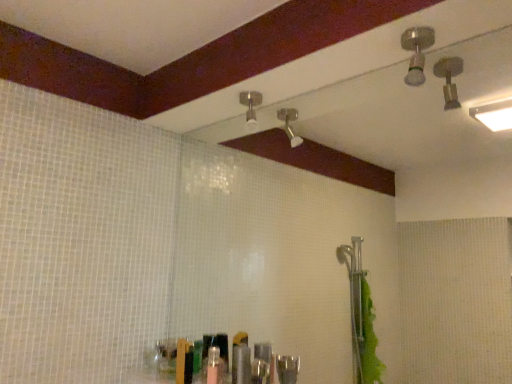
This screenshot has height=384, width=512. Describe the element at coordinates (250, 106) in the screenshot. I see `matte silver shower head at upper center, the 2th shower positioned from the right` at that location.

The image size is (512, 384). What do you see at coordinates (241, 359) in the screenshot?
I see `metallic silver toiletries at center` at bounding box center [241, 359].

Identify the location of matte silver shower head at upper center, the 2th shower in the front-to-back sequence. (250, 106).

I want to click on shower below the brushed metal shower head at upper right, acting as the 2th shower starting from the left (from the image's perspective), so click(x=250, y=106).

Looking at this image, considering the relative positions of brushed metal shower head at upper right, positioned as the 1th shower in front-to-back order, and matte silver shower head at upper center, the 1th shower from the left, in the image provided, is brushed metal shower head at upper right, positioned as the 1th shower in front-to-back order, to the left of matte silver shower head at upper center, the 1th shower from the left, from the viewer's perspective?

No.

From a real-world perspective, is brushed metal shower head at upper right, acting as the first shower starting from the right, positioned under matte silver shower head at upper center, the 2th shower positioned from the right, based on gravity?

Actually, brushed metal shower head at upper right, acting as the first shower starting from the right, is physically above matte silver shower head at upper center, the 2th shower positioned from the right, in the real world.

From the image's perspective, which object appears higher, brushed metal shower head at upper right, acting as the 2th shower starting from the left, or matte silver shower head at upper center, the 2th shower positioned from the right?

brushed metal shower head at upper right, acting as the 2th shower starting from the left.

Is metallic silver toiletries at center oriented away from brushed metal shower head at upper right, acting as the first shower starting from the right?

No.

From the image's perspective, would you say metallic silver toiletries at center is shown under brushed metal shower head at upper right, marked as the 2th shower in a back-to-front arrangement?

Correct, metallic silver toiletries at center appears lower than brushed metal shower head at upper right, marked as the 2th shower in a back-to-front arrangement, in the image.

Between metallic silver toiletries at center and brushed metal shower head at upper right, marked as the 2th shower in a back-to-front arrangement, which one has more height?

metallic silver toiletries at center.

Is metallic silver toiletries at center in contact with brushed metal shower head at upper right, marked as the 2th shower in a back-to-front arrangement?

No, metallic silver toiletries at center is not in contact with brushed metal shower head at upper right, marked as the 2th shower in a back-to-front arrangement.

Does brushed metal shower head at upper right, acting as the first shower starting from the right, turn towards metallic silver toiletries at center?

No, brushed metal shower head at upper right, acting as the first shower starting from the right, is not aimed at metallic silver toiletries at center.

Is brushed metal shower head at upper right, acting as the first shower starting from the right, taller than metallic silver toiletries at center?

In fact, brushed metal shower head at upper right, acting as the first shower starting from the right, may be shorter than metallic silver toiletries at center.

Measure the distance from brushed metal shower head at upper right, acting as the 2th shower starting from the left, to metallic silver toiletries at center.

brushed metal shower head at upper right, acting as the 2th shower starting from the left, and metallic silver toiletries at center are 1.08 meters apart.

In the scene shown: Does matte silver shower head at upper center, which appears as the 1th shower when viewed from the back, come behind brushed metal shower head at upper right, marked as the 2th shower in a back-to-front arrangement?

Yes, it is behind brushed metal shower head at upper right, marked as the 2th shower in a back-to-front arrangement.

Does point (249, 108) come behind point (415, 43)?

Yes, it is behind point (415, 43).

From a real-world perspective, is matte silver shower head at upper center, the 2th shower positioned from the right, over brushed metal shower head at upper right, marked as the 2th shower in a back-to-front arrangement?

No.

Who is bigger, matte silver shower head at upper center, the 1th shower from the left, or brushed metal shower head at upper right, positioned as the 1th shower in front-to-back order?

matte silver shower head at upper center, the 1th shower from the left.

How different are the orientations of metallic silver toiletries at center and matte silver shower head at upper center, the 2th shower in the front-to-back sequence, in degrees?

The facing directions of metallic silver toiletries at center and matte silver shower head at upper center, the 2th shower in the front-to-back sequence, are 1.15 degrees apart.

Is metallic silver toiletries at center thinner than matte silver shower head at upper center, the 1th shower from the left?

Yes.

From their relative heights in the image, would you say metallic silver toiletries at center is taller or shorter than matte silver shower head at upper center, the 2th shower in the front-to-back sequence?

metallic silver toiletries at center is taller than matte silver shower head at upper center, the 2th shower in the front-to-back sequence.

Which point is more forward, (248, 360) or (261, 99)?

The point (248, 360) is closer.

You are a GUI agent. You are given a task and a screenshot of the screen. Output one action in this format:
    pyautogui.click(x=<x>, y=<y>)
    Task: Click on the 1st shower located above the metallic silver toiletries at center (from a real-world perspective)
    
    Given the screenshot: What is the action you would take?
    pyautogui.click(x=250, y=106)

Based on their sizes in the image, would you say matte silver shower head at upper center, which appears as the 1th shower when viewed from the back, is bigger or smaller than metallic silver toiletries at center?

matte silver shower head at upper center, which appears as the 1th shower when viewed from the back, is bigger than metallic silver toiletries at center.

Is matte silver shower head at upper center, the 1th shower from the left, oriented towards metallic silver toiletries at center?

No, matte silver shower head at upper center, the 1th shower from the left, is not turned towards metallic silver toiletries at center.

Is point (254, 103) positioned in front of point (245, 373)?

No, it is not.

What are the coordinates of `shower located in front of the matte silver shower head at upper center, the 2th shower in the front-to-back sequence` in the screenshot? It's located at (417, 52).

Image resolution: width=512 pixels, height=384 pixels. I want to click on toiletry located on the left of brushed metal shower head at upper right, marked as the 2th shower in a back-to-front arrangement, so (x=241, y=359).

Based on their spatial positions, is brushed metal shower head at upper right, positioned as the 1th shower in front-to-back order, or metallic silver toiletries at center closer to matte silver shower head at upper center, which appears as the 1th shower when viewed from the back?

brushed metal shower head at upper right, positioned as the 1th shower in front-to-back order, is positioned closer to the anchor matte silver shower head at upper center, which appears as the 1th shower when viewed from the back.

Looking at the image, which one is located further to brushed metal shower head at upper right, marked as the 2th shower in a back-to-front arrangement, matte silver shower head at upper center, the 1th shower from the left, or metallic silver toiletries at center?

metallic silver toiletries at center is positioned further to the anchor brushed metal shower head at upper right, marked as the 2th shower in a back-to-front arrangement.

Estimate the real-world distances between objects in this image. Which object is closer to metallic silver toiletries at center, matte silver shower head at upper center, the 2th shower positioned from the right, or brushed metal shower head at upper right, positioned as the 1th shower in front-to-back order?

Based on the image, matte silver shower head at upper center, the 2th shower positioned from the right, appears to be nearer to metallic silver toiletries at center.

When comparing their distances from metallic silver toiletries at center, does brushed metal shower head at upper right, acting as the first shower starting from the right, or matte silver shower head at upper center, which appears as the 1th shower when viewed from the back, seem further?

Result: Among the two, brushed metal shower head at upper right, acting as the first shower starting from the right, is located further to metallic silver toiletries at center.

When comparing their distances from matte silver shower head at upper center, the 2th shower positioned from the right, does metallic silver toiletries at center or brushed metal shower head at upper right, acting as the first shower starting from the right, seem closer?

The object closer to matte silver shower head at upper center, the 2th shower positioned from the right, is brushed metal shower head at upper right, acting as the first shower starting from the right.

Looking at the image, which one is located closer to brushed metal shower head at upper right, marked as the 2th shower in a back-to-front arrangement, metallic silver toiletries at center or matte silver shower head at upper center, the 1th shower from the left?

matte silver shower head at upper center, the 1th shower from the left, lies closer to brushed metal shower head at upper right, marked as the 2th shower in a back-to-front arrangement, than the other object.

Where is `shower that lies between brushed metal shower head at upper right, acting as the first shower starting from the right, and metallic silver toiletries at center from top to bottom`? This screenshot has height=384, width=512. shower that lies between brushed metal shower head at upper right, acting as the first shower starting from the right, and metallic silver toiletries at center from top to bottom is located at coordinates (250, 106).